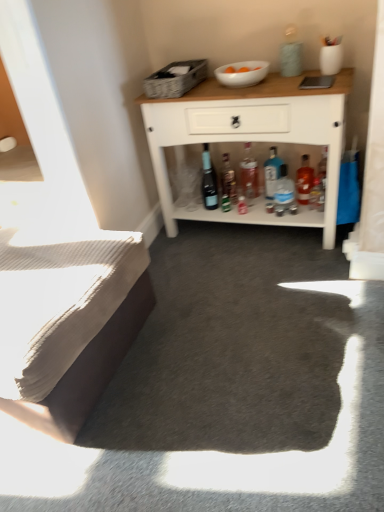
This screenshot has height=512, width=384. What are the coordinates of `white glossy bowl at upper center` in the screenshot? It's located at (242, 73).

The height and width of the screenshot is (512, 384). Identify the location of translucent plastic bottle at center, acting as the 4th bottle starting from the right. (249, 173).

This screenshot has height=512, width=384. Find the location of `translucent blue glass bottle at center, arranged as the fifth bottle when viewed from the left`. translucent blue glass bottle at center, arranged as the fifth bottle when viewed from the left is located at coordinates (284, 188).

In order to click on woven fabric picnic basket at upper center in this screenshot , I will do `click(175, 79)`.

I want to click on translucent glass bottle at center, acting as the 2th bottle starting from the left, so click(228, 179).

Which object is further away from the camera taking this photo, beige textured bed at lower left or translucent glass bottle at center, acting as the 2th bottle starting from the left?

translucent glass bottle at center, acting as the 2th bottle starting from the left, is further from the camera.

Is beige textured bed at lower left wider than translucent glass bottle at center, acting as the 2th bottle starting from the left?

Yes.

Considering the positions of point (71, 407) and point (230, 179), is point (71, 407) closer or farther from the camera than point (230, 179)?

Point (71, 407) is closer to the camera than point (230, 179).

The image size is (384, 512). What are the coordinates of `bottle that is the 4th object located above the beige textured bed at lower left (from the image's perspective)` in the screenshot? It's located at (228, 179).

Would you say matte glass bottle at center, the sixth bottle from the right, is inside or outside white glossy bowl at upper center?

matte glass bottle at center, the sixth bottle from the right, lies outside white glossy bowl at upper center.

From the image's perspective, which one is positioned higher, matte glass bottle at center, the sixth bottle from the right, or white glossy bowl at upper center?

white glossy bowl at upper center.

Could you tell me if matte glass bottle at center, the sixth bottle from the right, is facing white glossy bowl at upper center?

No, matte glass bottle at center, the sixth bottle from the right, does not turn towards white glossy bowl at upper center.

Does blue glass bottle at center, arranged as the third bottle when viewed from the right, appear on the right side of translucent glass bottle at center, acting as the 2th bottle starting from the left?

Yes, blue glass bottle at center, arranged as the third bottle when viewed from the right, is to the right of translucent glass bottle at center, acting as the 2th bottle starting from the left.

Measure the distance between blue glass bottle at center, the 4th bottle in the left-to-right sequence, and translucent glass bottle at center, which is counted as the 5th bottle, starting from the right.

20.74 centimeters.

Can you tell me how much blue glass bottle at center, arranged as the third bottle when viewed from the right, and translucent glass bottle at center, which is counted as the 5th bottle, starting from the right, differ in facing direction?

28.1 degrees separate the facing orientations of blue glass bottle at center, arranged as the third bottle when viewed from the right, and translucent glass bottle at center, which is counted as the 5th bottle, starting from the right.

This screenshot has height=512, width=384. I want to click on the 1st bottle above the translucent glass bottle at center, acting as the 2th bottle starting from the left (from the image's perspective), so click(272, 172).

Considering the relative positions of woven fabric picnic basket at upper center and beige textured bed at lower left in the image provided, is woven fabric picnic basket at upper center to the left of beige textured bed at lower left from the viewer's perspective?

Incorrect, woven fabric picnic basket at upper center is not on the left side of beige textured bed at lower left.

Based on the photo, from a real-world perspective, is woven fabric picnic basket at upper center positioned over beige textured bed at lower left based on gravity?

Indeed, from a real-world perspective, woven fabric picnic basket at upper center stands above beige textured bed at lower left.

Looking at this image, in terms of width, does woven fabric picnic basket at upper center look wider or thinner when compared to beige textured bed at lower left?

woven fabric picnic basket at upper center is thinner than beige textured bed at lower left.

Considering the points (149, 84) and (68, 360), which point is behind, point (149, 84) or point (68, 360)?

Point (149, 84)

Could you measure the distance between white glossy bowl at upper center and woven fabric picnic basket at upper center?

white glossy bowl at upper center is 7.96 inches from woven fabric picnic basket at upper center.

Can you confirm if white glossy bowl at upper center is wider than woven fabric picnic basket at upper center?

No, white glossy bowl at upper center is not wider than woven fabric picnic basket at upper center.

Is white glossy bowl at upper center with woven fabric picnic basket at upper center?

No.

Is white glossy bowl at upper center further to camera compared to woven fabric picnic basket at upper center?

Yes.

From the picture: What's the angular difference between translucent glass bottle at center, marked as the first bottle in a right-to-left arrangement, and matte glass bottle at center, the sixth bottle from the right,'s facing directions?

They differ by 12.8 degrees in their facing directions.

Is translucent glass bottle at center, the sixth bottle in the left-to-right sequence, beside matte glass bottle at center, the sixth bottle from the right?

No, translucent glass bottle at center, the sixth bottle in the left-to-right sequence, is not with matte glass bottle at center, the sixth bottle from the right.

Is matte glass bottle at center, positioned as the first bottle in left-to-right order, at the back of translucent glass bottle at center, the sixth bottle in the left-to-right sequence?

No.

Locate an element on the screen. This screenshot has width=384, height=512. the 1st bottle below the matte glass bottle at center, the sixth bottle from the right (from the image's perspective) is located at coordinates (304, 181).

In the image, is translucent glass bottle at center, the sixth bottle in the left-to-right sequence, positioned in front of or behind white wood cabinet at upper center?

Visually, translucent glass bottle at center, the sixth bottle in the left-to-right sequence, is located behind white wood cabinet at upper center.

Find the location of a particular element. This screenshot has width=384, height=512. the 2nd bottle behind when counting from the white wood cabinet at upper center is located at coordinates (304, 181).

How many degrees apart are the facing directions of translucent glass bottle at center, marked as the first bottle in a right-to-left arrangement, and white wood cabinet at upper center?

0.323 degrees separate the facing orientations of translucent glass bottle at center, marked as the first bottle in a right-to-left arrangement, and white wood cabinet at upper center.

Measure the distance from translucent glass bottle at center, the sixth bottle in the left-to-right sequence, to white wood cabinet at upper center.

translucent glass bottle at center, the sixth bottle in the left-to-right sequence, is 42.55 centimeters from white wood cabinet at upper center.

From a real-world perspective, which bottle is the 1st one above the beige textured bed at lower left? Please provide its 2D coordinates.

[(228, 179)]

Which bottle is the 3rd one when counting from the back of the white glossy bowl at upper center? Please provide its 2D coordinates.

[(209, 181)]

Which object lies further to the anchor point white wood cabinet at upper center, translucent glass bottle at center, acting as the 2th bottle starting from the left, or blue glass bottle at center, arranged as the third bottle when viewed from the right?

Based on the image, translucent glass bottle at center, acting as the 2th bottle starting from the left, appears to be further to white wood cabinet at upper center.

Based on their spatial positions, is translucent glass bottle at center, the sixth bottle in the left-to-right sequence, or white glossy bowl at upper center further from translucent blue glass bottle at center, arranged as the second bottle when viewed from the right?

white glossy bowl at upper center is positioned further to the anchor translucent blue glass bottle at center, arranged as the second bottle when viewed from the right.

Estimate the real-world distances between objects in this image. Which object is further from translucent blue glass bottle at center, arranged as the second bottle when viewed from the right, matte glass bottle at center, the sixth bottle from the right, or beige textured bed at lower left?

The object further to translucent blue glass bottle at center, arranged as the second bottle when viewed from the right, is beige textured bed at lower left.

Based on their spatial positions, is woven fabric picnic basket at upper center or translucent glass bottle at center, marked as the first bottle in a right-to-left arrangement, closer to beige textured bed at lower left?

woven fabric picnic basket at upper center lies closer to beige textured bed at lower left than the other object.

Looking at the image, which one is located further to white glossy bowl at upper center, translucent blue glass bottle at center, arranged as the second bottle when viewed from the right, or matte glass bottle at center, positioned as the first bottle in left-to-right order?

Based on the image, translucent blue glass bottle at center, arranged as the second bottle when viewed from the right, appears to be further to white glossy bowl at upper center.

When comparing their distances from translucent plastic bottle at center, acting as the 4th bottle starting from the right, does matte glass bottle at center, positioned as the first bottle in left-to-right order, or white wood cabinet at upper center seem closer?

The object closer to translucent plastic bottle at center, acting as the 4th bottle starting from the right, is matte glass bottle at center, positioned as the first bottle in left-to-right order.

Based on their spatial positions, is woven fabric picnic basket at upper center or translucent glass bottle at center, which is counted as the 5th bottle, starting from the right, further from beige textured bed at lower left?

translucent glass bottle at center, which is counted as the 5th bottle, starting from the right, lies further to beige textured bed at lower left than the other object.

Which object lies further to the anchor point matte glass bottle at center, positioned as the first bottle in left-to-right order, translucent glass bottle at center, which is counted as the 5th bottle, starting from the right, or translucent plastic bottle at center, acting as the 4th bottle starting from the right?

The object further to matte glass bottle at center, positioned as the first bottle in left-to-right order, is translucent plastic bottle at center, acting as the 4th bottle starting from the right.

Locate an element on the screen. Image resolution: width=384 pixels, height=512 pixels. bowl located between woven fabric picnic basket at upper center and blue glass bottle at center, the 4th bottle in the left-to-right sequence, in the left-right direction is located at coordinates (242, 73).

The width and height of the screenshot is (384, 512). In order to click on cabinetry between white glossy bowl at upper center and translucent glass bottle at center, marked as the first bottle in a right-to-left arrangement, in the vertical direction in this screenshot , I will do `click(250, 137)`.

This screenshot has width=384, height=512. I want to click on bowl between woven fabric picnic basket at upper center and translucent blue glass bottle at center, arranged as the second bottle when viewed from the right, in the up-down direction, so click(242, 73).

Where is `cabinetry between woven fabric picnic basket at upper center and translucent glass bottle at center, the sixth bottle in the left-to-right sequence, in the horizontal direction`? The width and height of the screenshot is (384, 512). cabinetry between woven fabric picnic basket at upper center and translucent glass bottle at center, the sixth bottle in the left-to-right sequence, in the horizontal direction is located at coordinates (250, 137).